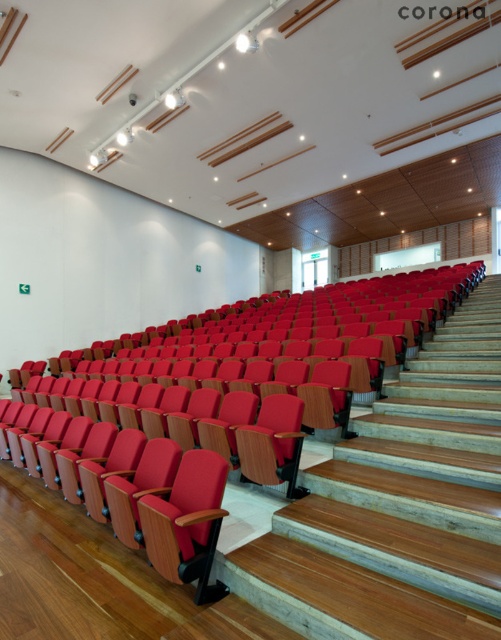
You are a maintenance worker in the auditorium. You need to move a 60 cm wide tool cart through the space between the wooden at center and the matte red seat at center. Can the tool cart fit through that space?

The wooden at center and matte red seat at center are 64.24 centimeters apart from each other. Since the tool cart is 60 cm wide, it can fit through the space as 64.24 cm is wider than 60 cm.